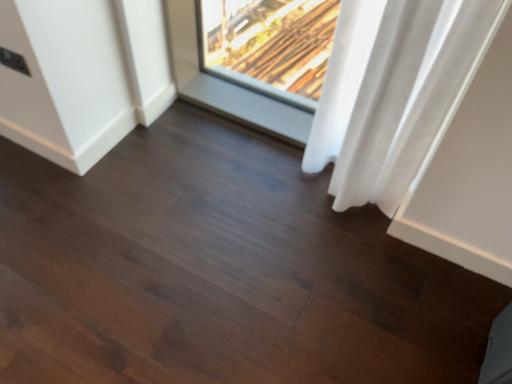
Identify the location of vacant region below white sheer curtain at right (from a real-world perspective). (346, 211).